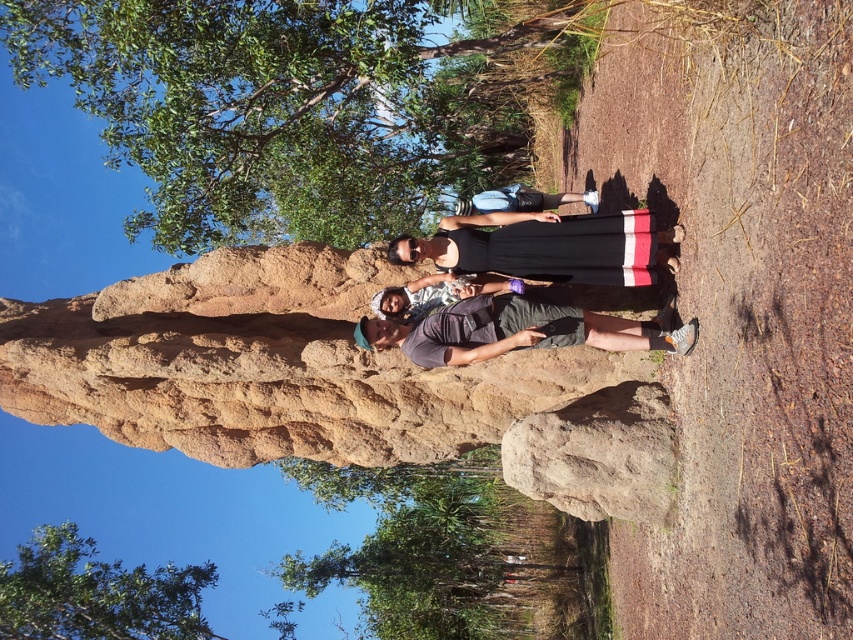
Does brown rough rock at lower center come in front of black dress at center?

No, brown rough rock at lower center is behind black dress at center.

The image size is (853, 640). I want to click on brown rough rock at lower center, so click(598, 454).

Is green leafy tree at lower left to the left of black dress at center from the viewer's perspective?

Indeed, green leafy tree at lower left is positioned on the left side of black dress at center.

Is green leafy tree at lower left bigger than black dress at center?

Yes.

Is point (149, 589) in front of point (541, 225)?

That is False.

Locate an element on the screen. green leafy tree at lower left is located at coordinates (96, 593).

Does green leafy tree at center have a smaller size compared to dark gray fabric shirt at center?

No, green leafy tree at center is not smaller than dark gray fabric shirt at center.

Does green leafy tree at center appear under dark gray fabric shirt at center?

Incorrect, green leafy tree at center is not positioned below dark gray fabric shirt at center.

Is point (447, 44) positioned before point (676, 349)?

No, it is behind (676, 349).

At what (x,y) coordinates should I click in order to perform the action: click on green leafy tree at center. Please return your answer as a coordinate pair (x, y). The width and height of the screenshot is (853, 640). Looking at the image, I should click on (276, 109).